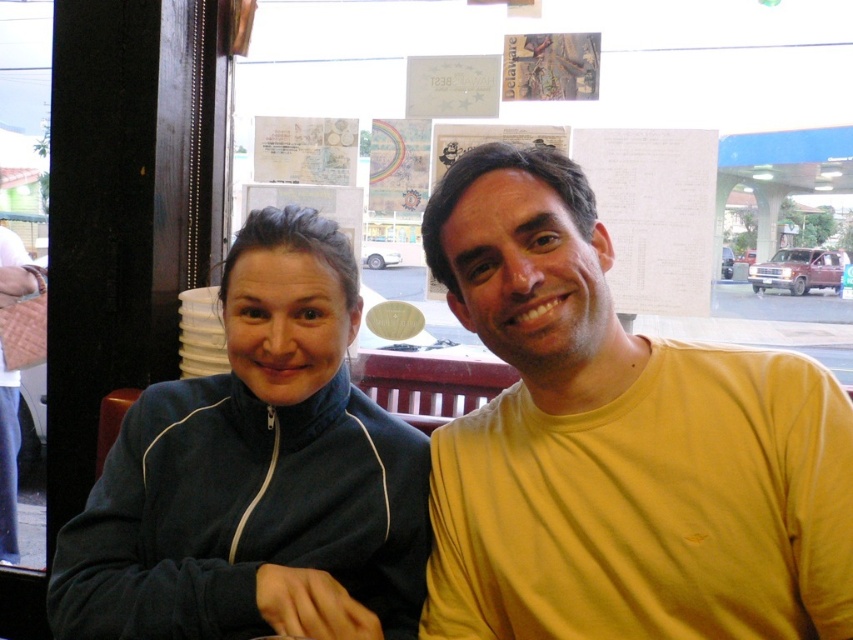
Question: Does yellow cotton t-shirt at center come behind dark blue zip-up jacket at center?

Choices:
 (A) yes
 (B) no

Answer: (B)

Question: In this image, where is yellow cotton t-shirt at center located relative to dark blue zip-up jacket at center?

Choices:
 (A) above
 (B) below

Answer: (A)

Question: Can you confirm if yellow cotton t-shirt at center is wider than dark blue zip-up jacket at center?

Choices:
 (A) no
 (B) yes

Answer: (A)